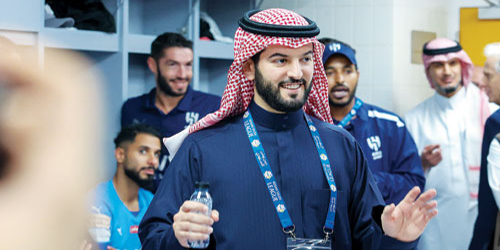
You are a GUI agent. You are given a task and a screenshot of the screen. Output one action in this format:
    pyautogui.click(x=<x>, y=<y>)
    Task: Click on the tiled walls
    This screenshot has height=250, width=500.
    Given the screenshot: What is the action you would take?
    pyautogui.click(x=375, y=30), pyautogui.click(x=415, y=19)